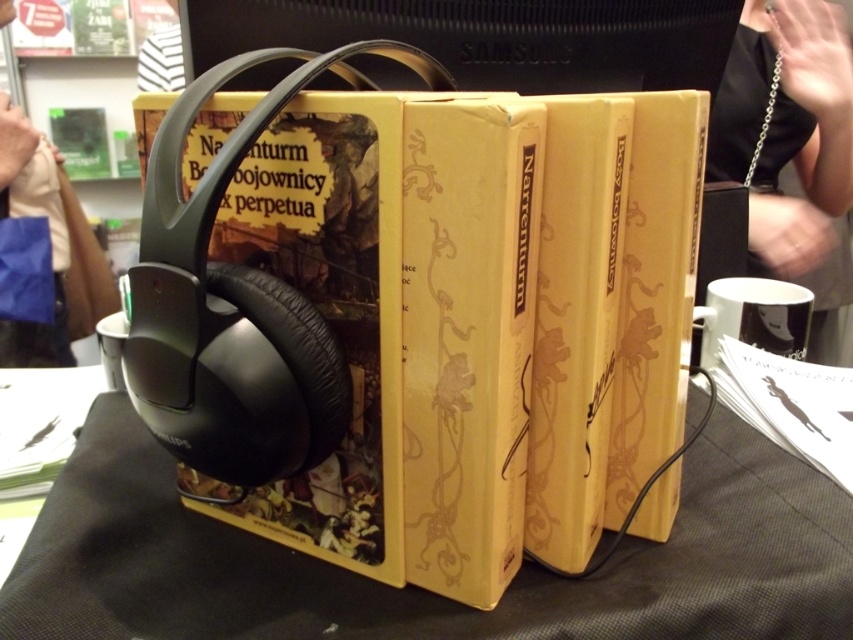
Question: Considering the relative positions of yellow paperback book at center and black matte table at center in the image provided, where is yellow paperback book at center located with respect to black matte table at center?

Choices:
 (A) below
 (B) above

Answer: (B)

Question: Which object is positioned closest to the black matte table at center?

Choices:
 (A) yellow paperback book at center
 (B) black leather handbag at upper right

Answer: (A)

Question: Does yellow paperback book at center appear on the left side of black leather handbag at upper right?

Choices:
 (A) yes
 (B) no

Answer: (A)

Question: Which point appears farthest from the camera in this image?

Choices:
 (A) (122, 572)
 (B) (573, 416)

Answer: (A)

Question: Is yellow paperback book at center above black leather handbag at upper right?

Choices:
 (A) yes
 (B) no

Answer: (B)

Question: Which of the following is the closest to the observer?

Choices:
 (A) black leather handbag at upper right
 (B) black matte table at center
 (C) yellow paperback book at center

Answer: (C)